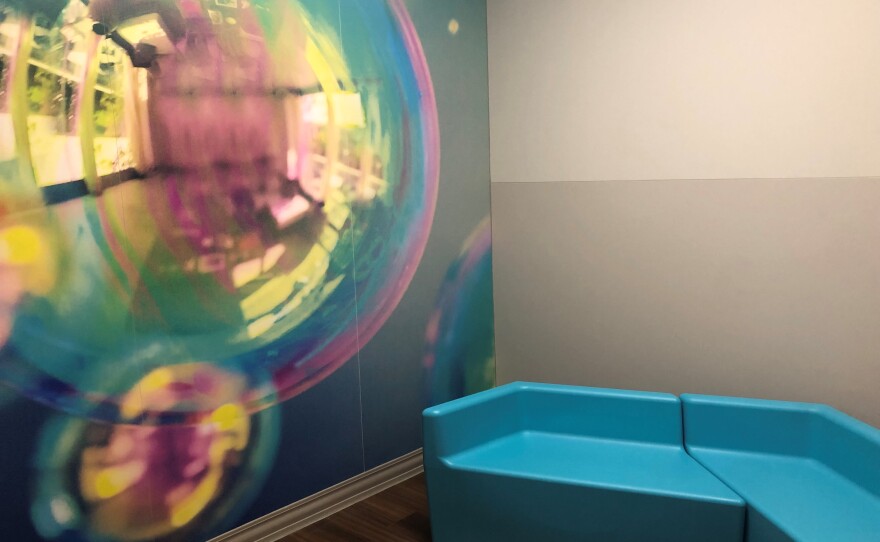
Image resolution: width=880 pixels, height=542 pixels. In order to click on white part of wall in this screenshot , I will do `click(704, 122)`.